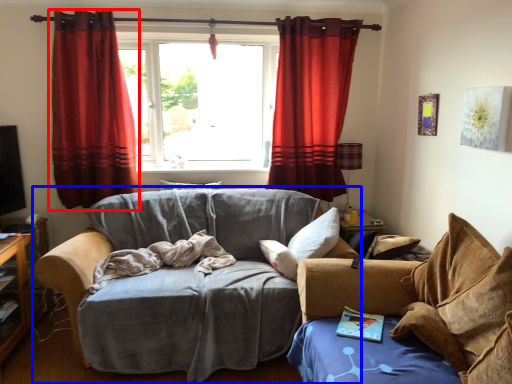
Question: Among these objects, which one is farthest to the camera, curtain (highlighted by a red box) or studio couch (highlighted by a blue box)?

Choices:
 (A) curtain
 (B) studio couch

Answer: (A)